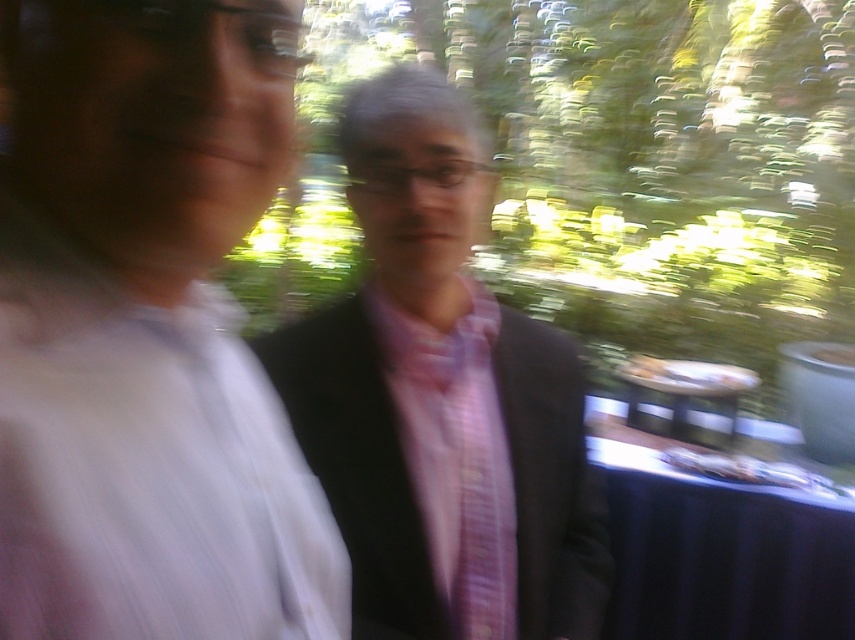
Between pink satin shirt at left and matte black suit at center, which one appears on the left side from the viewer's perspective?

From the viewer's perspective, pink satin shirt at left appears more on the left side.

Does point (316, 547) lie behind point (460, 467)?

No.

Where is `pink satin shirt at left`? Image resolution: width=855 pixels, height=640 pixels. pink satin shirt at left is located at coordinates (146, 332).

I want to click on matte black suit at center, so click(x=441, y=400).

Is matte black suit at center thinner than blue fabric table at lower right?

Yes, matte black suit at center is thinner than blue fabric table at lower right.

Is point (428, 202) closer to camera compared to point (771, 492)?

Yes, it is.

Where is `matte black suit at center`? This screenshot has width=855, height=640. matte black suit at center is located at coordinates (441, 400).

Between point (16, 390) and point (431, 384), which one is positioned behind?

Point (431, 384)

Is pink satin shirt at left below pink striped tie at center?

Incorrect, pink satin shirt at left is not positioned below pink striped tie at center.

Which is behind, point (270, 177) or point (488, 625)?

Positioned behind is point (488, 625).

In order to click on pink satin shirt at left in this screenshot , I will do `click(146, 332)`.